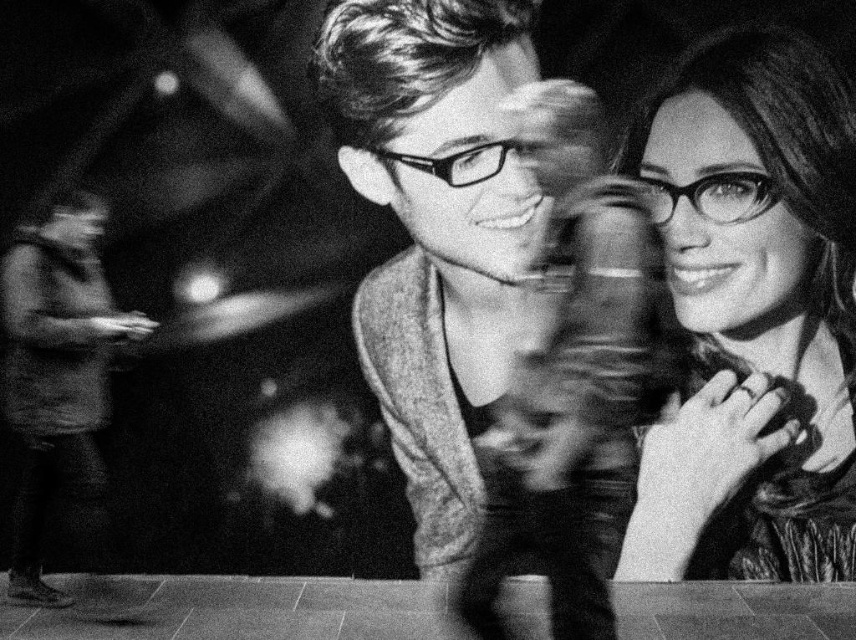
Question: Which of the following is the farthest from the observer?

Choices:
 (A) smooth leather jacket at center
 (B) smooth fabric shirt at lower left

Answer: (A)

Question: Does smooth leather jacket at center appear on the left side of matte black glasses at upper right?

Choices:
 (A) no
 (B) yes

Answer: (B)

Question: Which point is farther from the camera taking this photo?

Choices:
 (A) (322, 40)
 (B) (94, 490)
 (C) (711, 61)

Answer: (B)

Question: Can you confirm if smooth leather jacket at center is positioned to the right of smooth fabric shirt at lower left?

Choices:
 (A) no
 (B) yes

Answer: (B)

Question: Which object is positioned closest to the smooth leather jacket at center?

Choices:
 (A) matte black glasses at upper right
 (B) smooth fabric shirt at lower left

Answer: (A)

Question: Considering the relative positions of matte black glasses at upper right and smooth fabric shirt at lower left in the image provided, where is matte black glasses at upper right located with respect to smooth fabric shirt at lower left?

Choices:
 (A) right
 (B) left

Answer: (A)